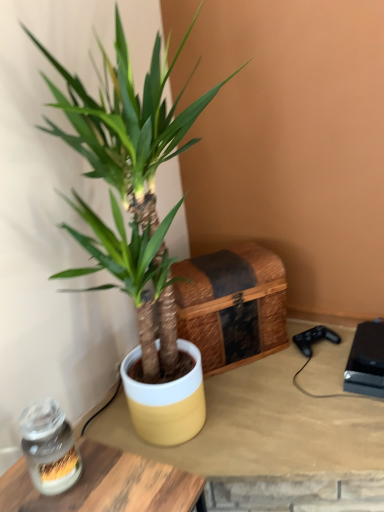
Question: Is green matte plant at center facing towards woven wood chest at center?

Choices:
 (A) yes
 (B) no

Answer: (B)

Question: Considering the relative sizes of green matte plant at center and woven wood chest at center in the image provided, is green matte plant at center bigger than woven wood chest at center?

Choices:
 (A) yes
 (B) no

Answer: (A)

Question: Is green matte plant at center oriented away from woven wood chest at center?

Choices:
 (A) no
 (B) yes

Answer: (A)

Question: Does green matte plant at center appear on the right side of woven wood chest at center?

Choices:
 (A) no
 (B) yes

Answer: (A)

Question: Is green matte plant at center beside woven wood chest at center?

Choices:
 (A) no
 (B) yes

Answer: (A)

Question: Is green matte plant at center outside woven wood chest at center?

Choices:
 (A) yes
 (B) no

Answer: (A)

Question: Considering the relative sizes of woven wood chest at center and yellow matte pot at center, which is counted as the 2th table, starting from the front, in the image provided, is woven wood chest at center wider than yellow matte pot at center, which is counted as the 2th table, starting from the front,?

Choices:
 (A) yes
 (B) no

Answer: (B)

Question: Would you say woven wood chest at center is a long distance from yellow matte pot at center, which is the 1th table in back-to-front order?

Choices:
 (A) no
 (B) yes

Answer: (A)

Question: From a real-world perspective, is woven wood chest at center under yellow matte pot at center, which is the 1th table in back-to-front order?

Choices:
 (A) no
 (B) yes

Answer: (A)

Question: Can you confirm if woven wood chest at center is thinner than yellow matte pot at center, which is counted as the 2th table, starting from the front?

Choices:
 (A) no
 (B) yes

Answer: (B)

Question: Is woven wood chest at center positioned before yellow matte pot at center, which is the 1th table in back-to-front order?

Choices:
 (A) no
 (B) yes

Answer: (A)

Question: Is woven wood chest at center facing away from yellow matte pot at center, which is the 1th table in back-to-front order?

Choices:
 (A) no
 (B) yes

Answer: (A)

Question: Is green matte plant at center thinner than black plastic game console at lower right?

Choices:
 (A) no
 (B) yes

Answer: (A)